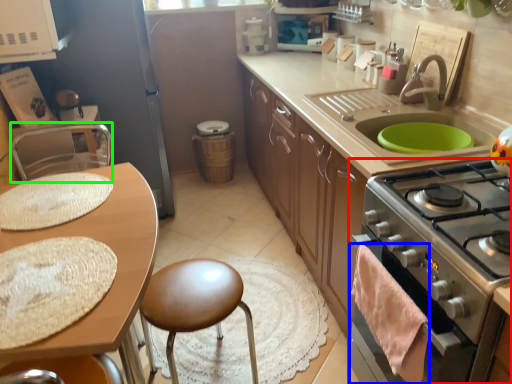
Question: Based on their relative distances, which object is farther from kitchen appliance (highlighted by a red box)? Choose from material (highlighted by a blue box) and chair (highlighted by a green box).

Choices:
 (A) material
 (B) chair

Answer: (B)